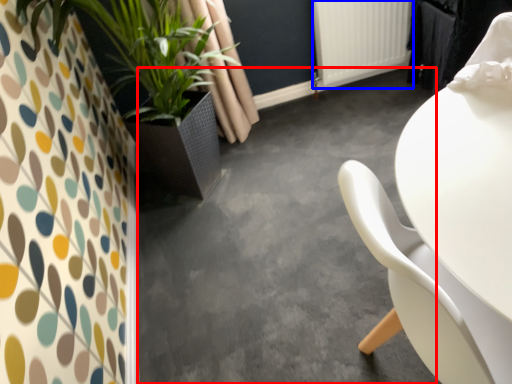
Question: Which point is closer to the camera, concrete (highlighted by a red box) or radiator (highlighted by a blue box)?

Choices:
 (A) concrete
 (B) radiator

Answer: (A)